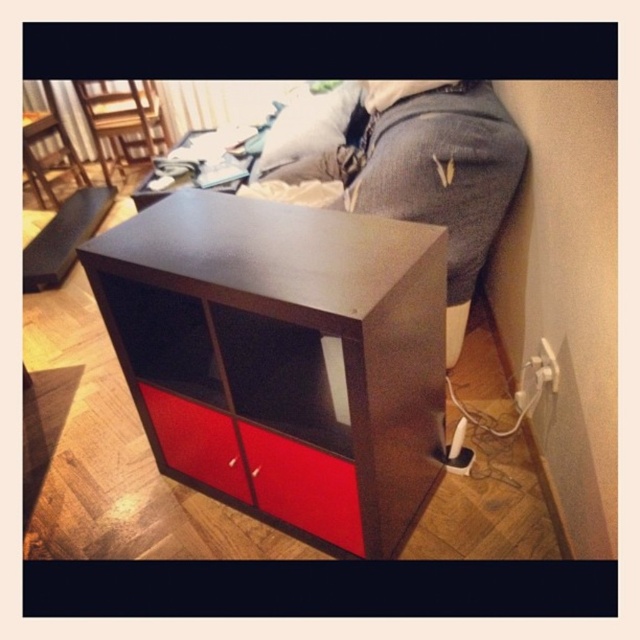
Question: Does matte black cabinet at center have a greater width compared to matte red drawer at lower center?

Choices:
 (A) no
 (B) yes

Answer: (B)

Question: Estimate the real-world distances between objects in this image. Which object is farther from the matte black side table at upper center?

Choices:
 (A) matte red drawer at lower center
 (B) matte black cabinet at center

Answer: (A)

Question: Is matte black cabinet at center to the right of matte red drawer at lower center from the viewer's perspective?

Choices:
 (A) no
 (B) yes

Answer: (B)

Question: Which of these objects is positioned closest to the matte red drawer at lower center?

Choices:
 (A) matte black side table at upper center
 (B) matte black cabinet at center

Answer: (B)

Question: Among these points, which one is nearest to the camera?

Choices:
 (A) (196, 426)
 (B) (371, 465)
 (C) (192, 182)

Answer: (B)

Question: Can you confirm if matte red drawer at lower center is positioned to the left of matte black side table at upper center?

Choices:
 (A) no
 (B) yes

Answer: (A)